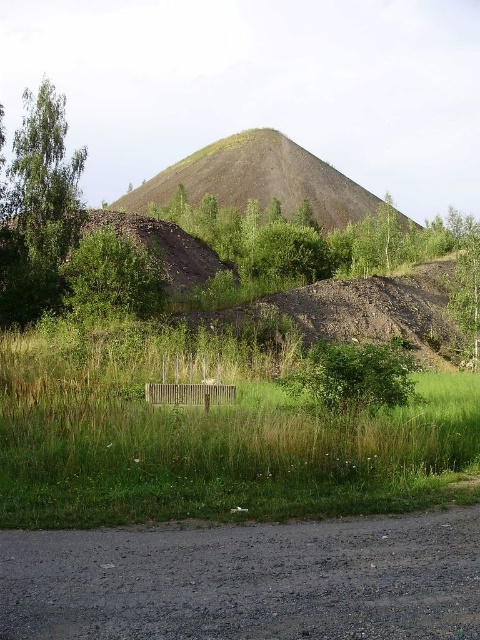
From the picture: You are standing at the base of the large conical mound in the image and want to reach the green leafy tree at left. Which direction should you walk to get there?

The green leafy tree at left is located at coordinates approximately 0.327 on the x and 0.079 on the y axis, so you should walk towards the lower left direction to reach it.

You are standing at the base of the large mound and want to determine which of the two plants in the center is closer to you. Both the green leafy tree at center and the green leafy bush at center are visible. Which one is nearer?

The green leafy tree at center is smaller in size compared to the green leafy bush at center, which indicates that the tree is farther away since smaller objects can appear closer or farther depending on their actual size and distance. However, based on the description provided, the tree is stated to have a smaller size, so it might be closer. Wait, this is conflicting. Let me think again. If the tree is smaller in size but appears the same in the image, then it would be farther. But the description says it

You are standing at the base of the conical mound and want to reach the green leafy tree at center marked by point [351,378]. Which direction should you head to from your current position?

The point [351,378] marks the green leafy tree at center, so you should head towards the center to reach it.